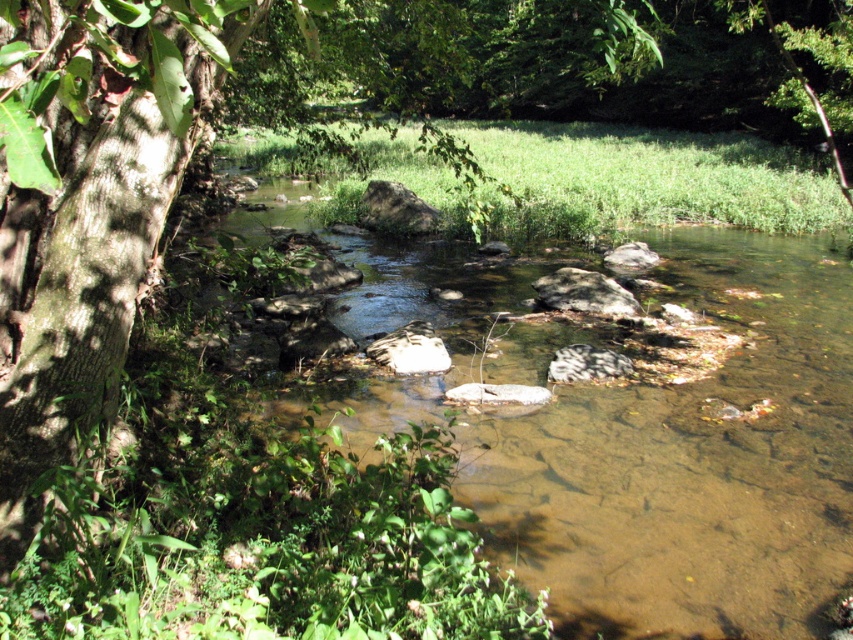
Question: Which point appears closest to the camera in this image?

Choices:
 (A) (405, 342)
 (B) (422, 230)

Answer: (A)

Question: Considering the relative positions of clear water at center and white smooth rock at center in the image provided, where is clear water at center located with respect to white smooth rock at center?

Choices:
 (A) left
 (B) right

Answer: (B)

Question: Is gray rough rock at center bigger than gray stone at center?

Choices:
 (A) no
 (B) yes

Answer: (B)

Question: Estimate the real-world distances between objects in this image. Which object is closer to the clear water at center?

Choices:
 (A) gray stone at center
 (B) brown rough tree trunk at left
 (C) gray rock at center
 (D) gray rough rock at center

Answer: (A)

Question: Can you confirm if gray/rough rock at center is positioned to the left of gray stone at center?

Choices:
 (A) no
 (B) yes

Answer: (A)

Question: Which of the following is the closest to the observer?

Choices:
 (A) white smooth rock at center
 (B) gray rock at center
 (C) clear water at center

Answer: (C)